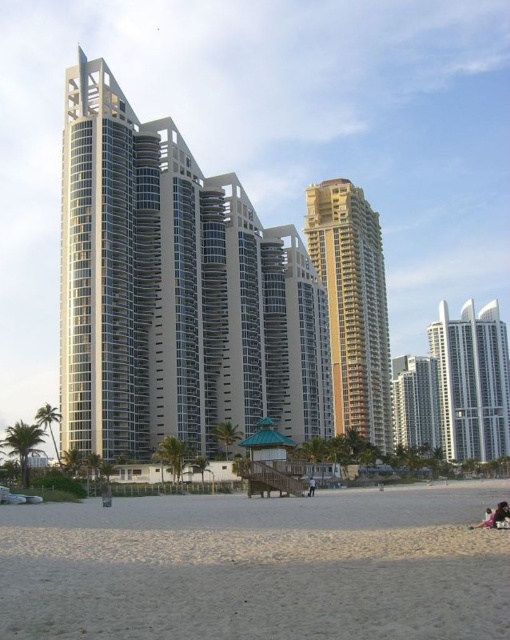
You are standing on the sandy beach and want to take a photo of the beige glass building at center. Which direction should you face to ensure the building is in the center of your camera view?

The beige glass building at center is located at point (174, 292), so you should face towards the center of the beach to have it in the center of your camera view.

You are a photographer planning to capture the gold textured building at center and the dark blue jeans at center in a single frame. Based on their widths, which object should you position closer to the center of your camera frame to ensure both fit without cropping?

The gold textured building at center is wider than the dark blue jeans at center. To ensure both fit in the frame without cropping, position the gold textured building at center closer to the center of your camera frame since it requires more space.

You are standing on the beach and want to walk from your current position to the wooden structure with a green roof. There is a beige glass building at center and dark blue jeans at center in your path. Which object do you need to go around first?

You need to go around the beige glass building at center first because it is closer to you than the dark blue jeans at center.